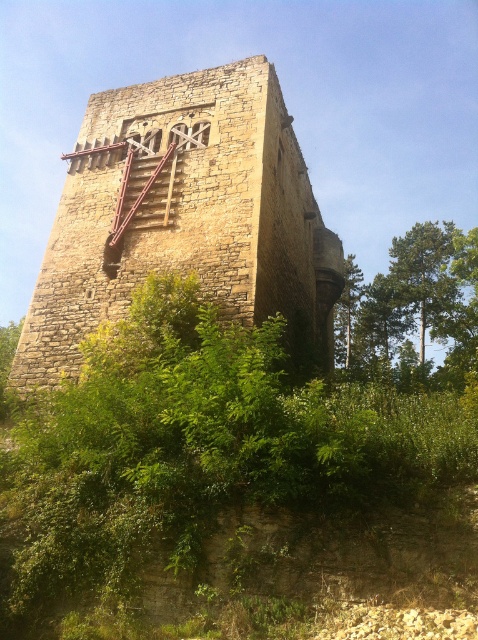
You are standing in front of the stone tower at center and notice a green leafy tree at right. Which structure is taller?

The green leafy tree at right is taller than the stone tower at center.

You are standing in front of the historic stone tower and notice two plants. Which one is closer to the tower, the green leafy bush at center or the green leafy tree at right?

The green leafy bush at center is closer to the tower because it is positioned to the left of the green leafy tree at right, placing it nearer to the structure.

You are standing at the base of the historic stone tower and want to take a photo. There are two points marked on the tower wall, one at coordinates point (458, 358) and the other at point (344, 332). Which point will appear larger in your photo?

Point (458, 358) is closer to the camera than point (344, 332), so it will appear larger in the photo.